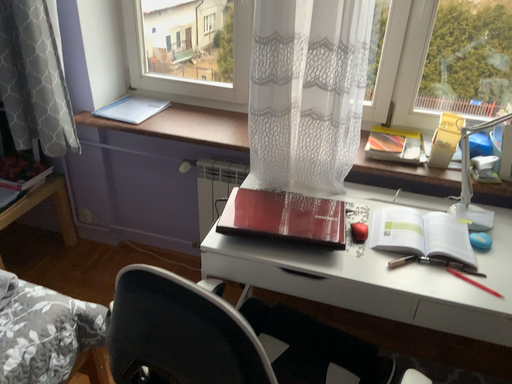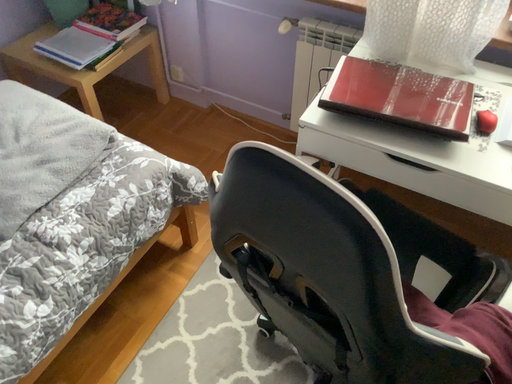
Question: Which way did the camera rotate in the video?

Choices:
 (A) rotated left
 (B) rotated right

Answer: (A)